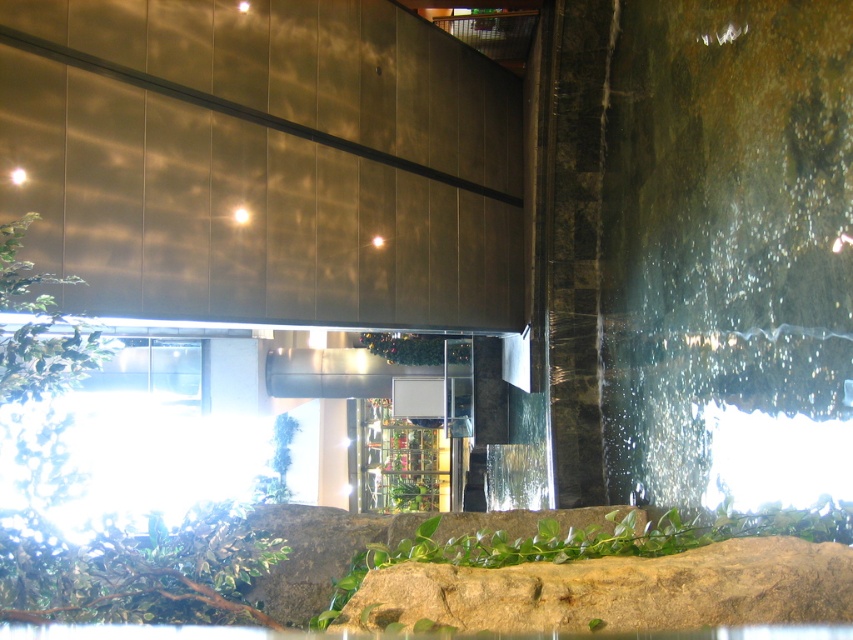
Question: Can you confirm if green leafy plant at center is smaller than green glossy plant at center?

Choices:
 (A) no
 (B) yes

Answer: (B)

Question: Is green leafy plant at center bigger than green glossy plant at center?

Choices:
 (A) yes
 (B) no

Answer: (B)

Question: Is green leafy plant at center bigger than green glossy plant at center?

Choices:
 (A) no
 (B) yes

Answer: (A)

Question: Which point is closer to the camera taking this photo?

Choices:
 (A) (495, 609)
 (B) (399, 364)

Answer: (A)